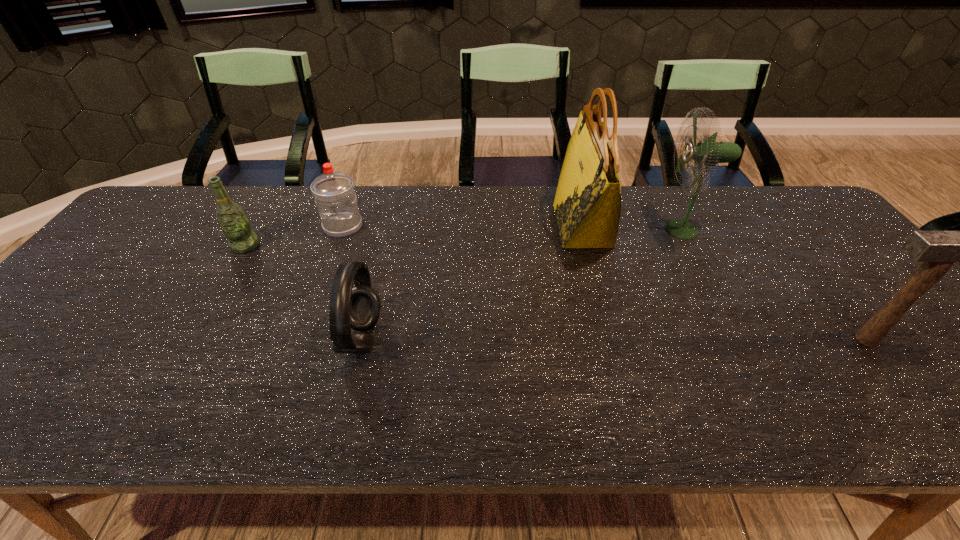
You are a GUI agent. You are given a task and a screenshot of the screen. Output one action in this format:
    pyautogui.click(x=<x>, y=<y>)
    Task: Click on the vacant position in the image that satisfies the following two spatial constraints: 1. on the front-facing side of the fifth object from left to right; 2. on the back side of the mallet
    Image resolution: width=960 pixels, height=540 pixels.
    Given the screenshot: What is the action you would take?
    pyautogui.click(x=741, y=340)

Image resolution: width=960 pixels, height=540 pixels. I want to click on free space that satisfies the following two spatial constraints: 1. on the back side of the third tallest object; 2. on the front-facing side of the third object from right to left, so click(776, 225).

The height and width of the screenshot is (540, 960). What are the coordinates of `vacant space that satisfies the following two spatial constraints: 1. on the front-facing side of the tote bag; 2. on the right side of the third tallest object` in the screenshot? It's located at (613, 340).